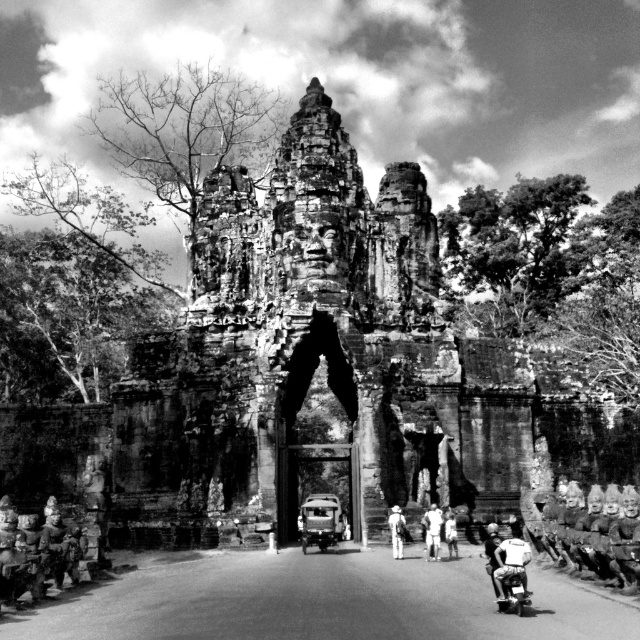
You are a photographer standing in front of the monumental stone gateway. You notice a white cotton shirt at center and a white fabric hat at center. Which item is closer to the gateway?

The white cotton shirt at center is positioned under the white fabric hat at center, meaning the shirt is closer to the gateway since it is below the hat in the scene.

You are a photographer aiming to capture a detailed shot of the central gateway. You have a white cotton shirt at center and a white fabric hat at center in your frame. Which object should you adjust to ensure both fit within the frame without overcrowding?

The white cotton shirt at center is wider than the white fabric hat at center. To prevent overcrowding, adjust the white cotton shirt at center first since it occupies more space in the frame.